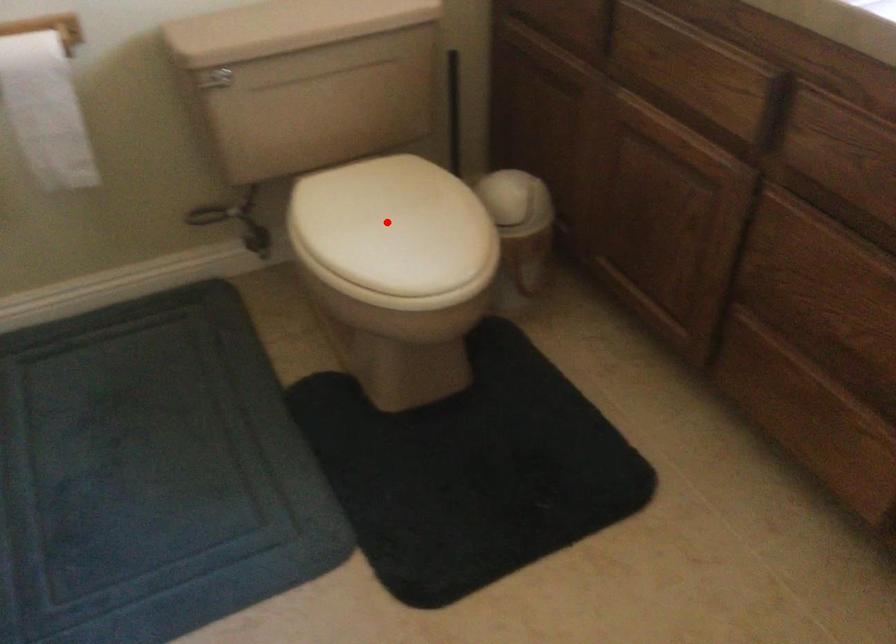
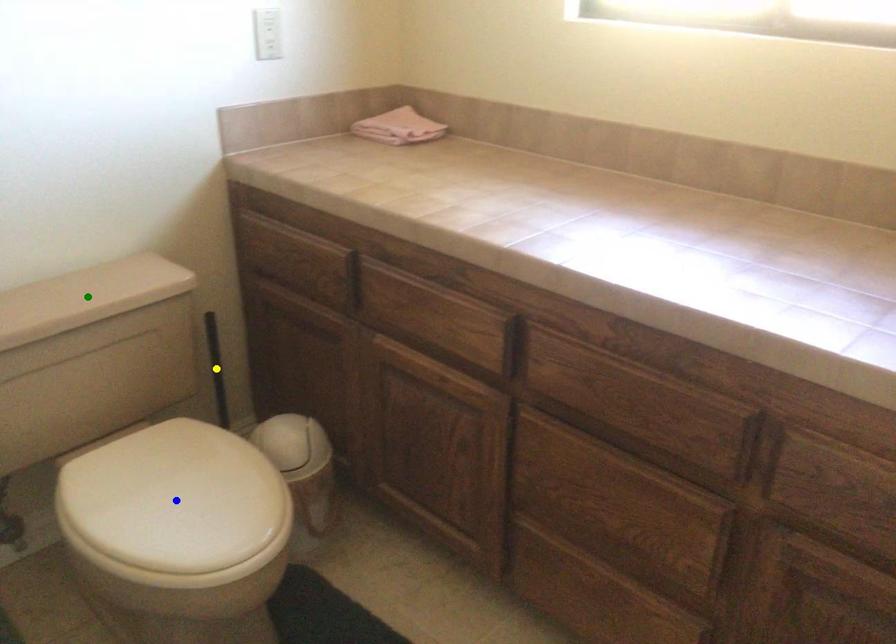
Question: I am providing you with two images of the same scene from different viewpoints. A red point is marked on the first image. You are given multiple points on the second image. Which point in image 2 is actually the same real-world point as the red point in image 1?

Choices:
 (A) blue point
 (B) yellow point
 (C) green point

Answer: (A)